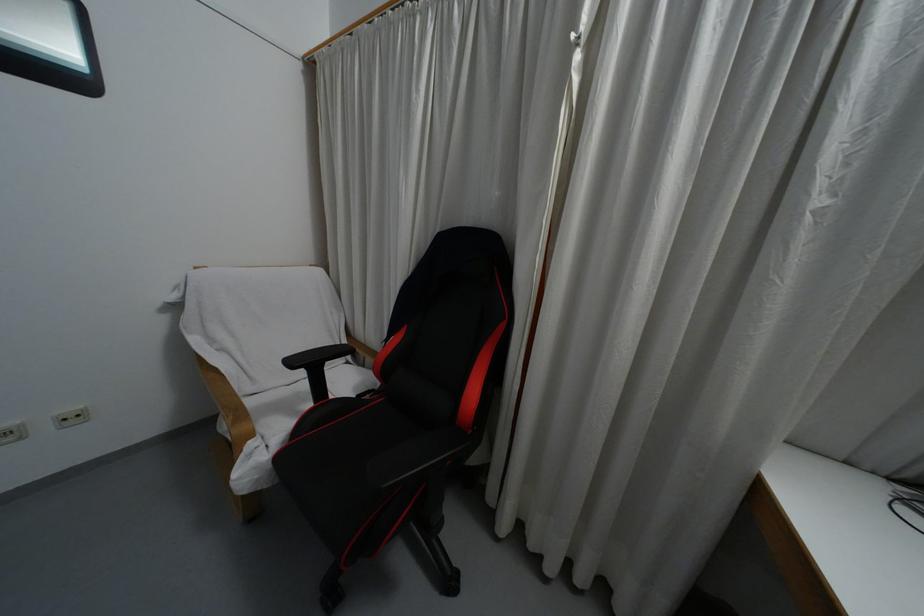
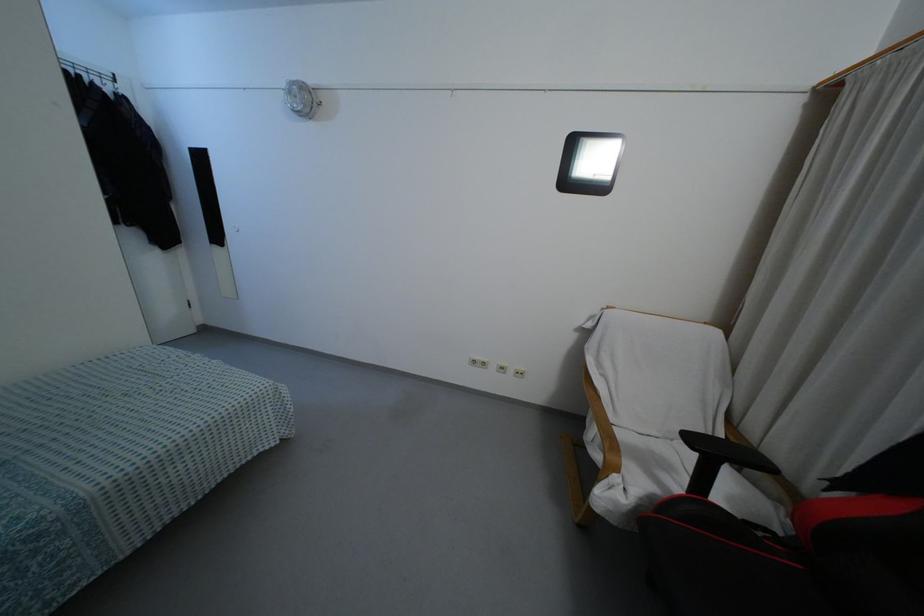
Question: The camera is either moving clockwise (left) or counter-clockwise (right) around the object. The first image is from the beginning of the video and the second image is from the end. Is the camera moving left or right when shooting the video?

Choices:
 (A) Left
 (B) Right

Answer: (B)